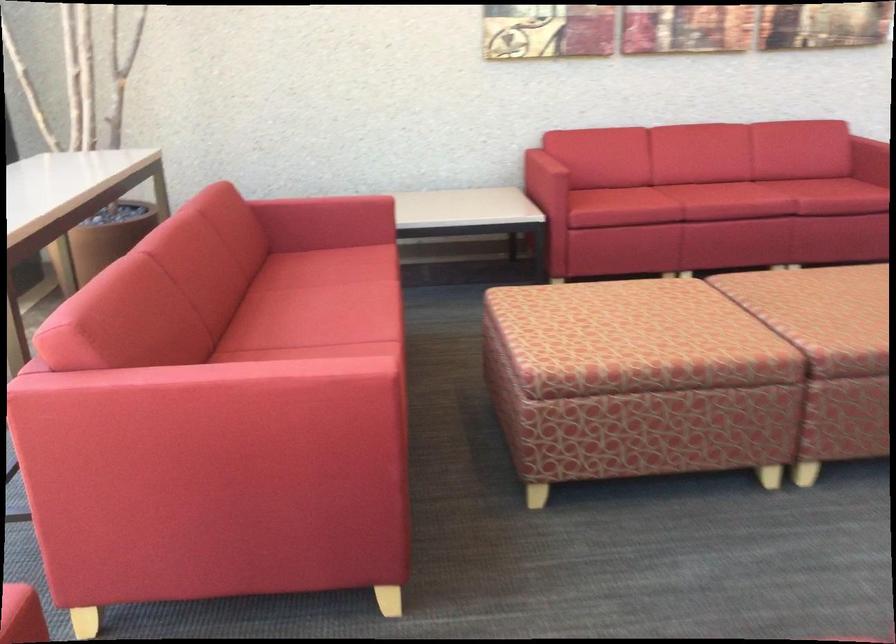
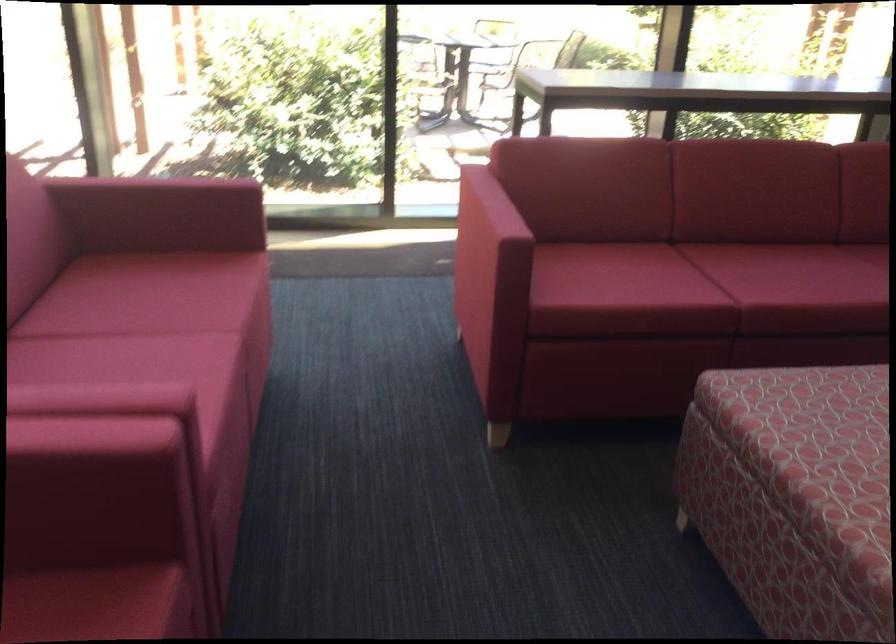
In the second image, find the point that corresponds to the point at 328,390 in the first image.

(487, 222)